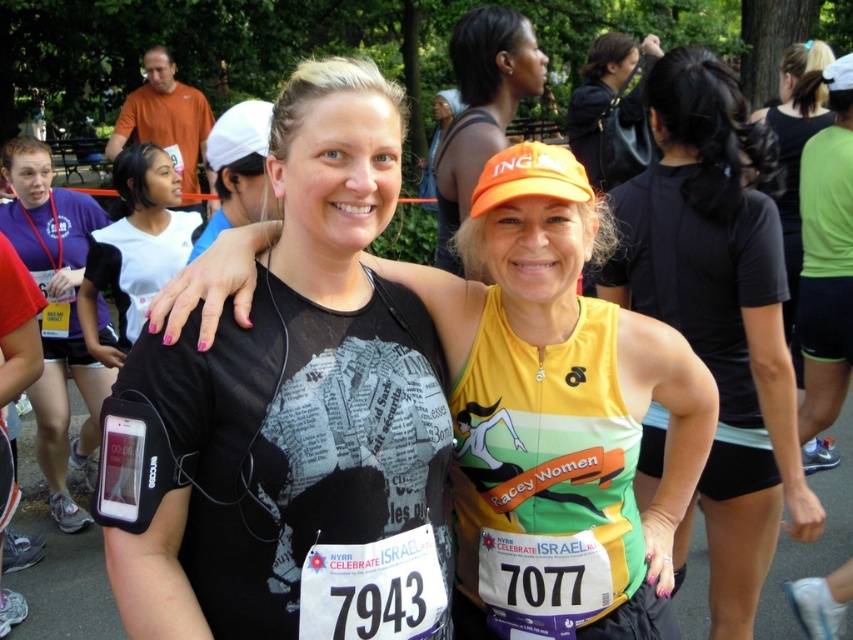
How distant is black mesh tank top at center from orange matte cap at upper center?

black mesh tank top at center and orange matte cap at upper center are 5.10 feet apart from each other.

Is point (114, 412) farther from viewer compared to point (469, 67)?

No, it is not.

Between point (363, 88) and point (514, 42), which one is positioned behind?

Positioned behind is point (514, 42).

The width and height of the screenshot is (853, 640). What are the coordinates of `black mesh tank top at center` in the screenshot? It's located at (286, 394).

Can you confirm if black mesh tank top at center is shorter than yellow-green jersey at center?

Indeed, black mesh tank top at center has a lesser height compared to yellow-green jersey at center.

Between black mesh tank top at center and yellow-green jersey at center, which one appears on the left side from the viewer's perspective?

black mesh tank top at center is more to the left.

Who is more forward, (289, 570) or (737, 536)?

Point (289, 570) is in front.

This screenshot has width=853, height=640. I want to click on black mesh tank top at center, so coord(286,394).

Between yellow-green jersey at center and matte purple shirt at left, which one is positioned lower?

yellow-green jersey at center

Is point (782, 426) in front of point (1, 157)?

Yes, it is in front of point (1, 157).

Find the location of `yellow-green jersey at center`. yellow-green jersey at center is located at coordinates (718, 316).